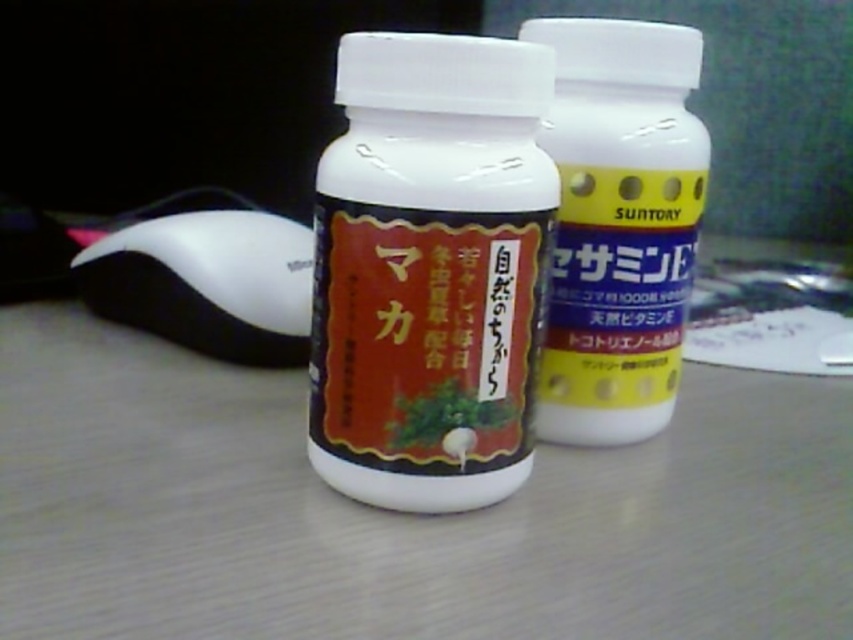
Does white glossy bottle at center come in front of white plastic mouse at lower left?

Yes, white glossy bottle at center is closer to the viewer.

Measure the distance between white glossy bottle at center and camera.

white glossy bottle at center is 22.17 inches away from camera.

You are a GUI agent. You are given a task and a screenshot of the screen. Output one action in this format:
    pyautogui.click(x=<x>, y=<y>)
    Task: Click on the white glossy bottle at center
    This screenshot has height=640, width=853.
    Given the screenshot: What is the action you would take?
    pyautogui.click(x=428, y=268)

Who is lower down, white plastic table at center or white glossy bottle at center?

Positioned lower is white plastic table at center.

Can you confirm if white plastic table at center is wider than white glossy bottle at center?

Yes, white plastic table at center is wider than white glossy bottle at center.

Identify the location of white plastic table at center. (396, 513).

Who is shorter, white glossy bottle at center or yellow matte bottle at center?

Standing shorter between the two is white glossy bottle at center.

Is point (390, 438) less distant than point (636, 292)?

Yes.

Identify the location of white glossy bottle at center. This screenshot has width=853, height=640. (428, 268).